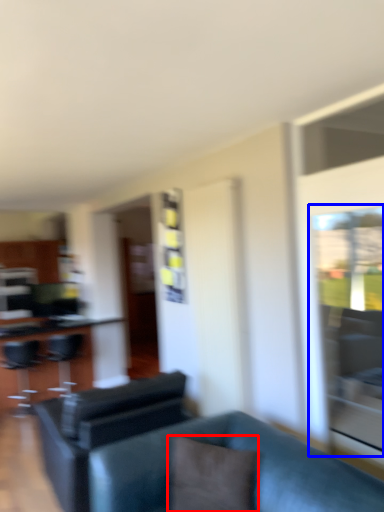
Question: Which object is closer to the camera taking this photo, pillow (highlighted by a red box) or glass door (highlighted by a blue box)?

Choices:
 (A) pillow
 (B) glass door

Answer: (A)